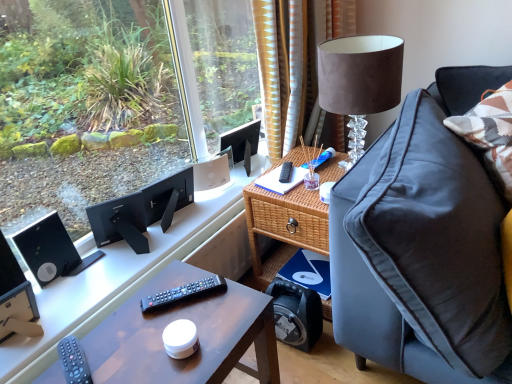
Locate an element on the screen. The width and height of the screenshot is (512, 384). vacant space that's between matte black remote control at lower left, the 1th remote control viewed from the left, and black plastic remote at center, the second remote control in the top-to-bottom sequence is located at coordinates (134, 334).